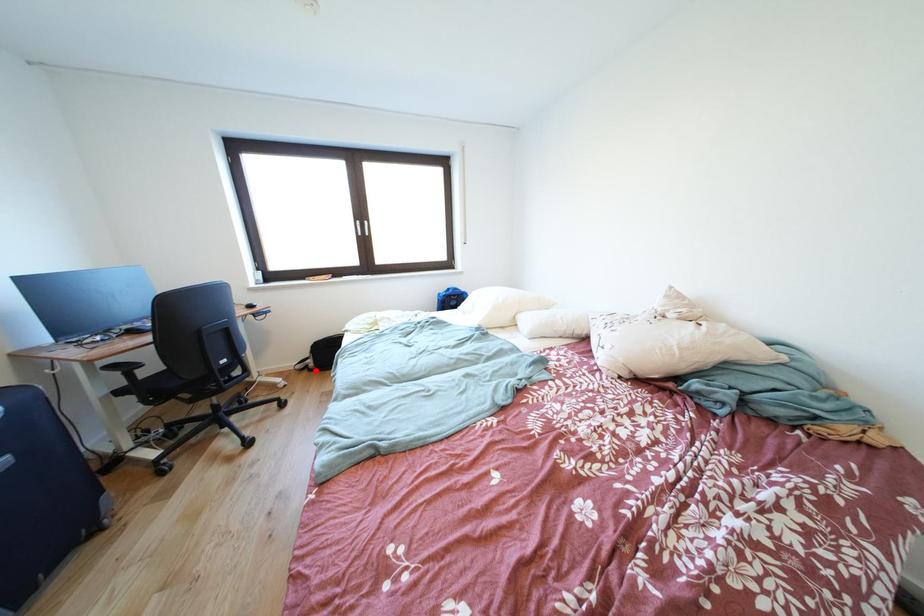
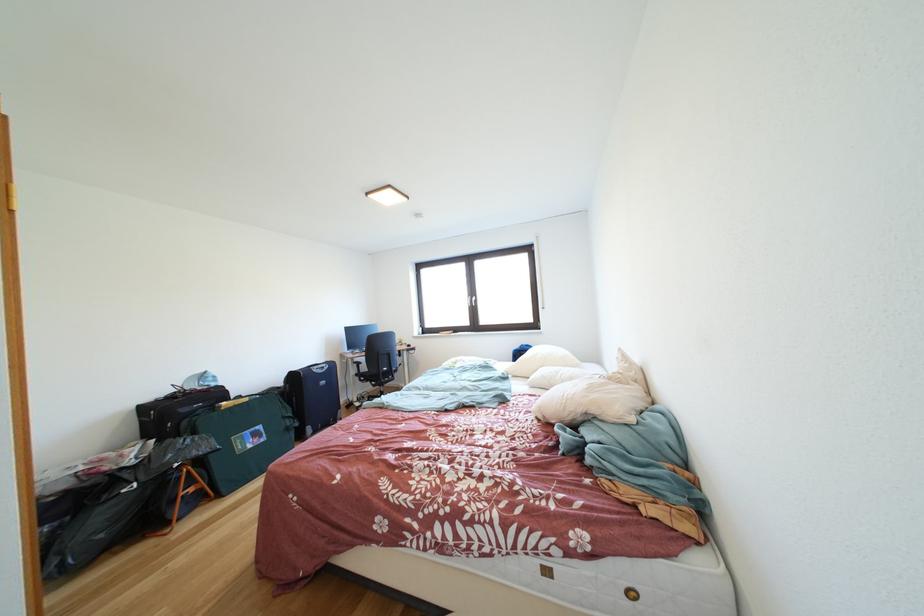
Question: I am providing you with two images of the same scene from different viewpoints. A red point is marked on the first image. At the location where the point appears in image 1, is it still visible in image 2?

Choices:
 (A) Yes
 (B) No

Answer: (B)